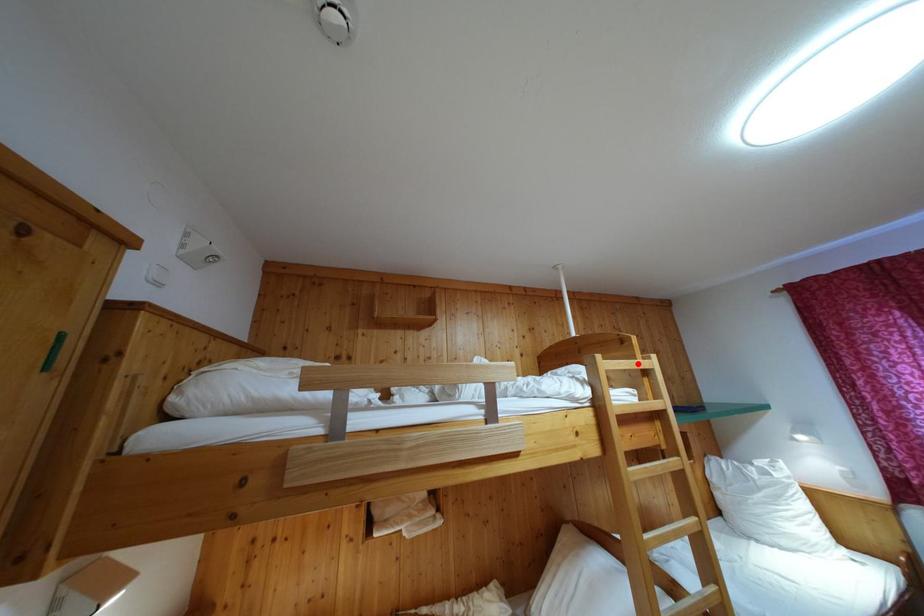
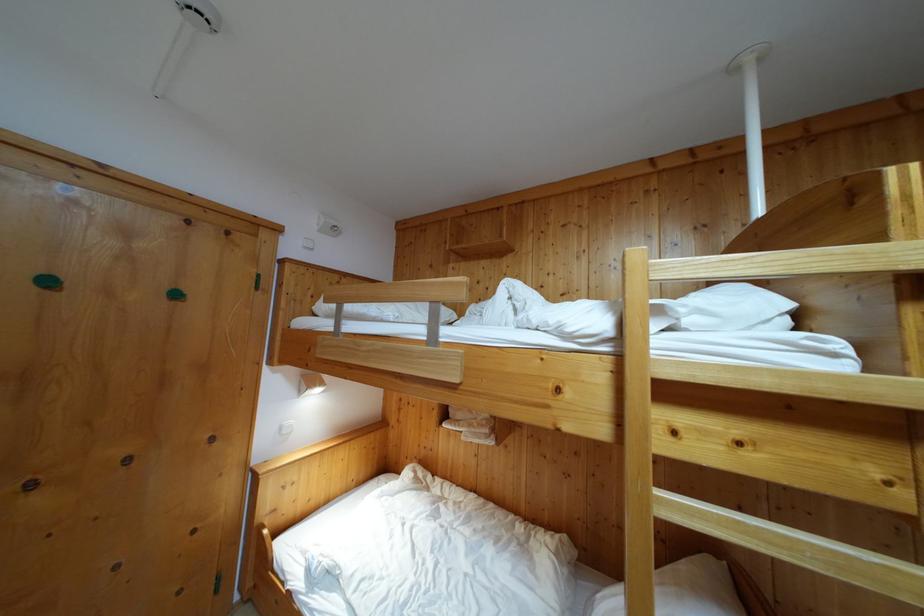
Question: I am providing you with two images of the same scene from different viewpoints. In image1, a red point is highlighted. Considering the same 3D point in image2, which of the following is correct?

Choices:
 (A) It is closer
 (B) It is farther

Answer: (B)